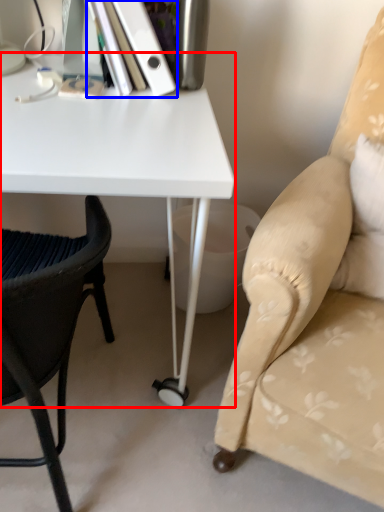
Question: Which point is further to the camera, desk (highlighted by a red box) or paperback book (highlighted by a blue box)?

Choices:
 (A) desk
 (B) paperback book

Answer: (B)